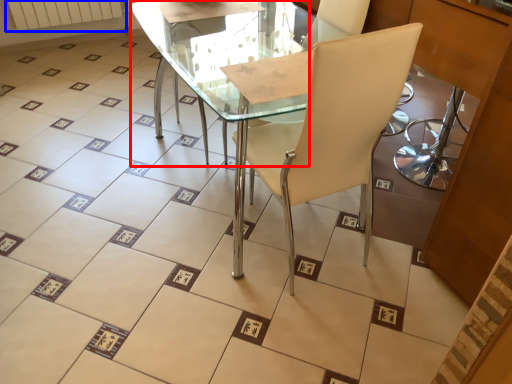
Question: Which point is closer to the camera, round table (highlighted by a red box) or radiator (highlighted by a blue box)?

Choices:
 (A) round table
 (B) radiator

Answer: (A)